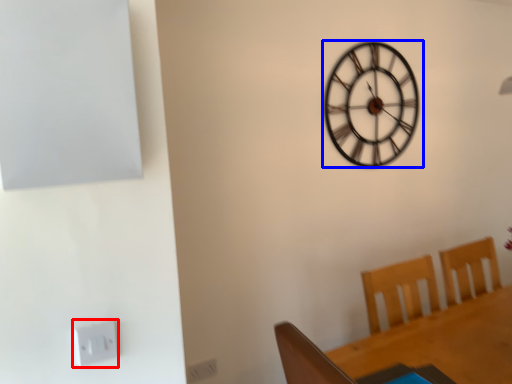
Question: Which object appears closest to the camera in this image, electric outlet (highlighted by a red box) or wall clock (highlighted by a blue box)?

Choices:
 (A) electric outlet
 (B) wall clock

Answer: (A)